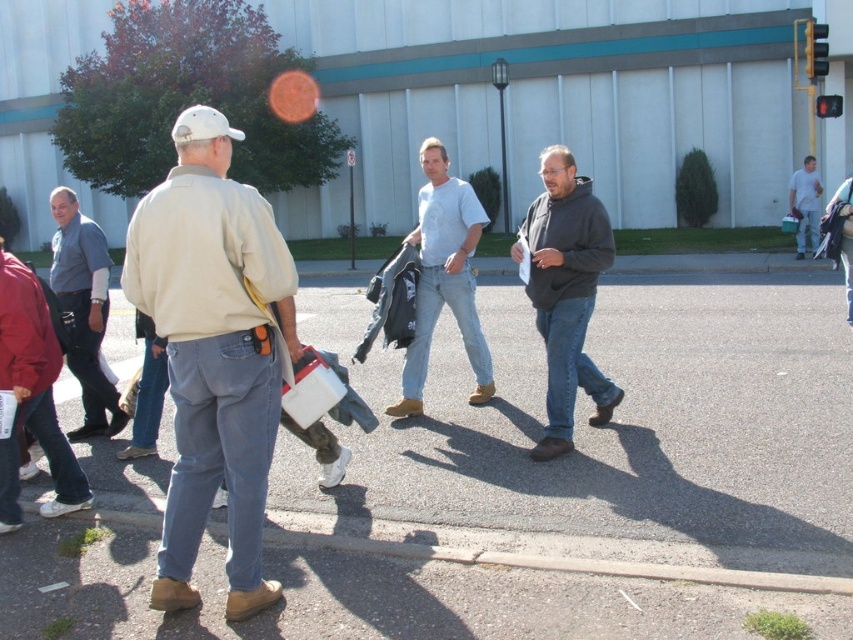
Question: Does beige fabric jacket at left appear on the left side of light gray t-shirt at center?

Choices:
 (A) yes
 (B) no

Answer: (A)

Question: Does beige fabric jacket at left have a smaller size compared to light gray t-shirt at center?

Choices:
 (A) yes
 (B) no

Answer: (B)

Question: Which of the following is the farthest from the observer?

Choices:
 (A) (416, 317)
 (B) (527, 291)

Answer: (A)

Question: Which of these objects is positioned farthest from the light gray t-shirt at center?

Choices:
 (A) beige fabric jacket at left
 (B) blue denim jeans at left
 (C) dark gray hoodie at center

Answer: (B)

Question: Which point is closer to the camera?

Choices:
 (A) (219, 356)
 (B) (566, 364)
 (C) (804, 184)
 (D) (457, 305)

Answer: (A)

Question: Does dark gray hoodie at center appear on the right side of light blue shirt at center?

Choices:
 (A) no
 (B) yes

Answer: (A)